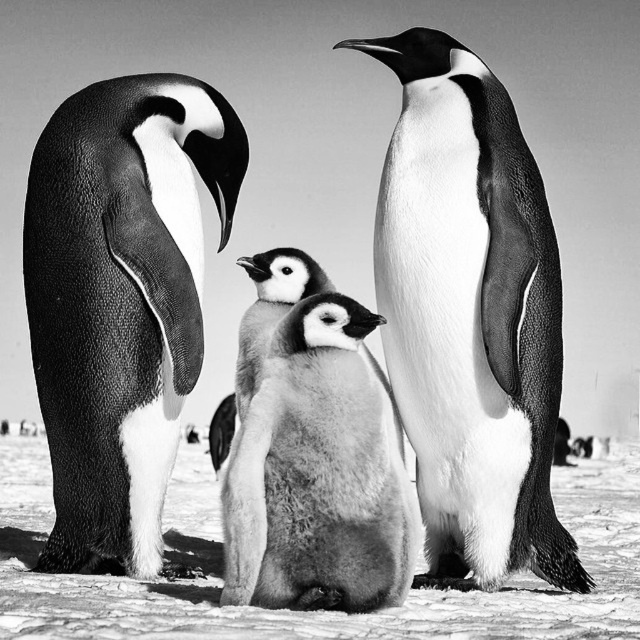
Is smooth black penguin at center above soft yellow down at center?

Yes.

Is smooth black penguin at center wider than soft yellow down at center?

Indeed, smooth black penguin at center has a greater width compared to soft yellow down at center.

The image size is (640, 640). I want to click on smooth black penguin at center, so click(470, 314).

Is soft yellow down at center wider than soft gray down feathers at center?

No.

Who is shorter, soft yellow down at center or soft gray down feathers at center?

soft yellow down at center

Does point (301, 250) come behind point (220, 428)?

That is False.

Image resolution: width=640 pixels, height=640 pixels. What are the coordinates of `soft yellow down at center` in the screenshot? It's located at (269, 308).

Between point (260, 520) and point (273, 266), which one is positioned behind?

The point (273, 266) is behind.

Locate an element on the screen. This screenshot has height=640, width=640. soft gray down at center is located at coordinates (320, 472).

Does point (362, 570) lie behind point (241, 364)?

That is False.

Locate an element on the screen. The height and width of the screenshot is (640, 640). soft gray down at center is located at coordinates (320, 472).